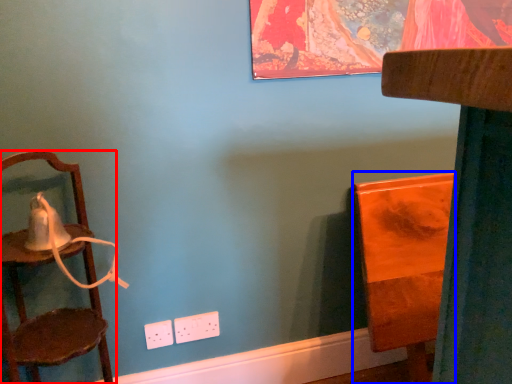
Question: Which object appears closest to the camera in this image, chair (highlighted by a red box) or furniture (highlighted by a blue box)?

Choices:
 (A) chair
 (B) furniture

Answer: (A)